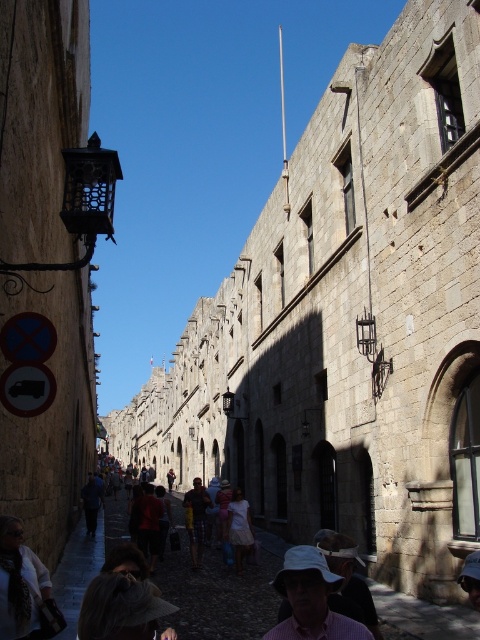
Question: Which point appears closest to the camera in this image?

Choices:
 (A) (x=308, y=604)
 (B) (x=25, y=593)

Answer: (A)

Question: Does white textured shirt at lower left lie in front of yellow cotton shirt at center?

Choices:
 (A) yes
 (B) no

Answer: (A)

Question: Estimate the real-world distances between objects in this image. Which object is farther from the pink checkered shirt at lower center?

Choices:
 (A) white textured shirt at lower left
 (B) white cotton dress at center

Answer: (B)

Question: Can you confirm if pink checkered shirt at lower center is positioned to the right of yellow cotton shirt at center?

Choices:
 (A) yes
 (B) no

Answer: (A)

Question: Does pink checkered shirt at lower center have a lesser width compared to white textured shirt at lower left?

Choices:
 (A) no
 (B) yes

Answer: (A)

Question: Which object is closer to the camera taking this photo?

Choices:
 (A) white textured shirt at lower left
 (B) yellow cotton shirt at center
 (C) white cotton dress at center

Answer: (A)